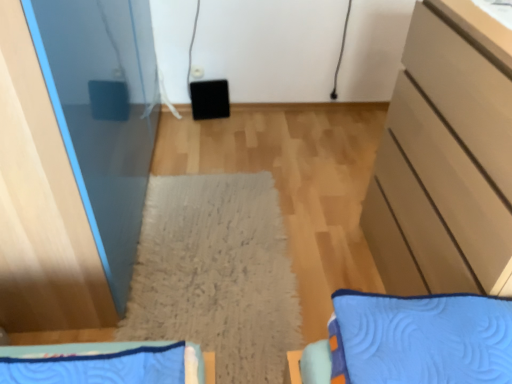
Image resolution: width=512 pixels, height=384 pixels. I want to click on vacant area situated below beige textured mat at center (from a real-world perspective), so click(x=207, y=286).